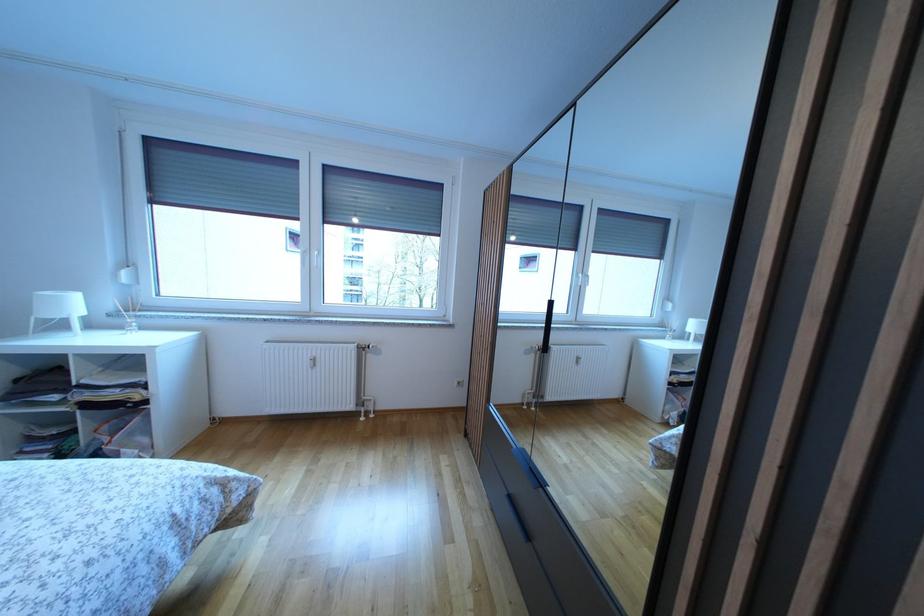
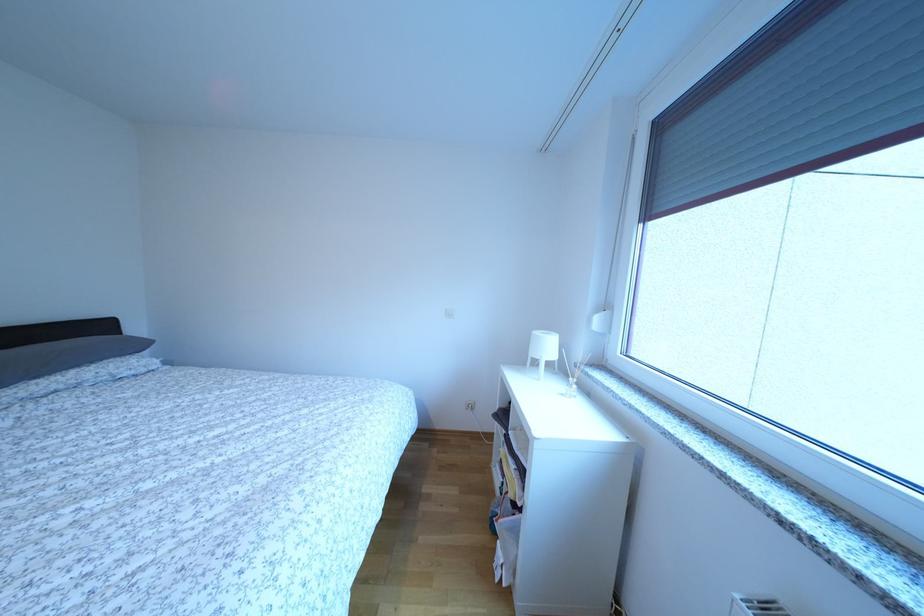
Locate, in the second image, the point that corresponds to (x=78, y=310) in the first image.

(554, 353)